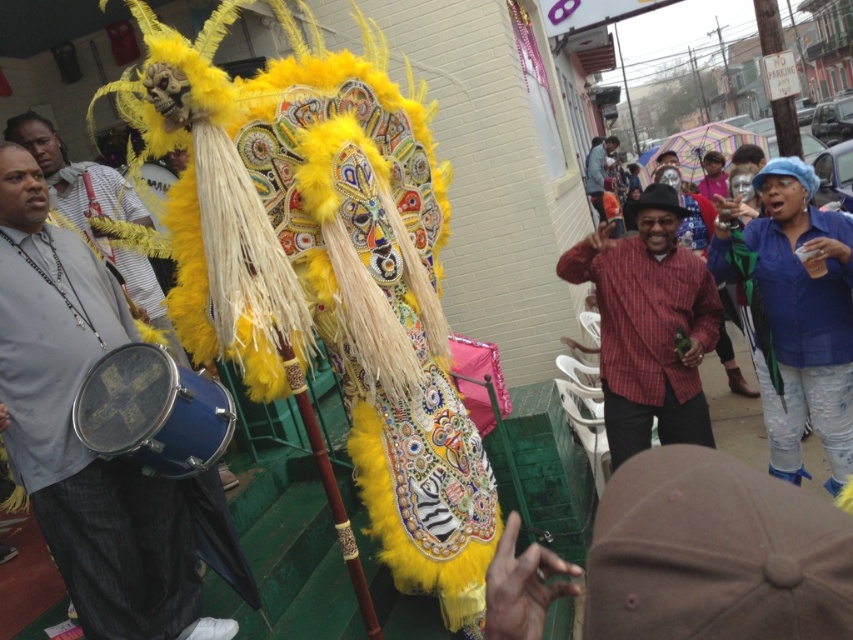
Is point (90, 550) in front of point (602, 216)?

Yes, point (90, 550) is in front of point (602, 216).

Is point (30, 352) farther from camera compared to point (599, 211)?

No.

Image resolution: width=853 pixels, height=640 pixels. What are the coordinates of `matte blue drum at center` in the screenshot? It's located at (74, 435).

Who is lower down, feathered yellow costume at center or matte red shirt at center?

feathered yellow costume at center is below.

Does feathered yellow costume at center have a larger size compared to matte red shirt at center?

No, feathered yellow costume at center is not bigger than matte red shirt at center.

Where is `feathered yellow costume at center`? feathered yellow costume at center is located at coordinates (105, 240).

Does red plaid shirt at center appear over blue denim jeans at lower right?

Yes.

Is point (618, 273) more distant than point (810, 276)?

Yes, point (618, 273) is farther from viewer.

Who is more forward, (672,432) or (785,348)?

Positioned in front is point (785,348).

Find the location of a particular element. The image size is (853, 640). red plaid shirt at center is located at coordinates (648, 324).